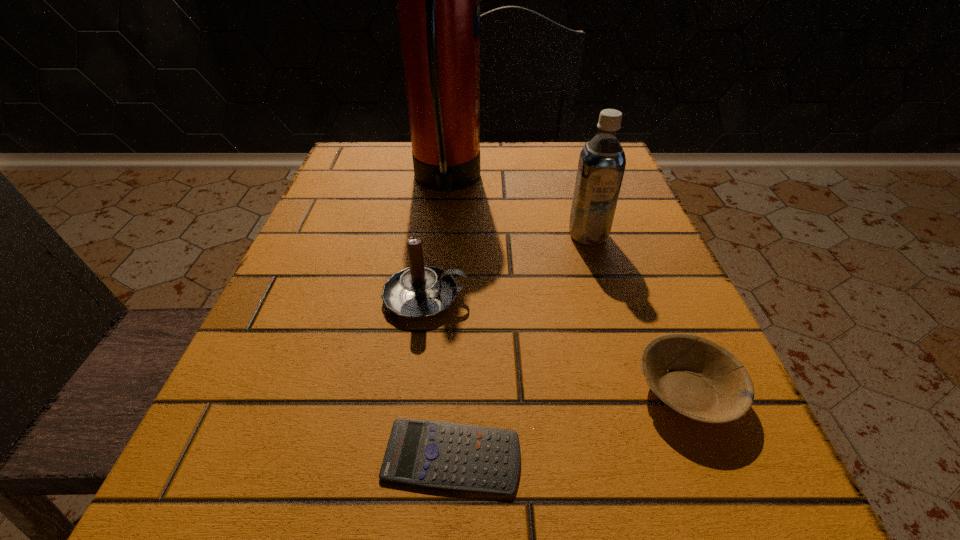
Where is `free spot that satisfies the following two spatial constraints: 1. on the back side of the calculator; 2. on the surface of the fire extinguisher`? Image resolution: width=960 pixels, height=540 pixels. free spot that satisfies the following two spatial constraints: 1. on the back side of the calculator; 2. on the surface of the fire extinguisher is located at coordinates (466, 182).

Locate an element on the screen. vacant area in the image that satisfies the following two spatial constraints: 1. on the label of the fourth nearest object; 2. on the side of the third farthest object with the handle loop is located at coordinates (607, 298).